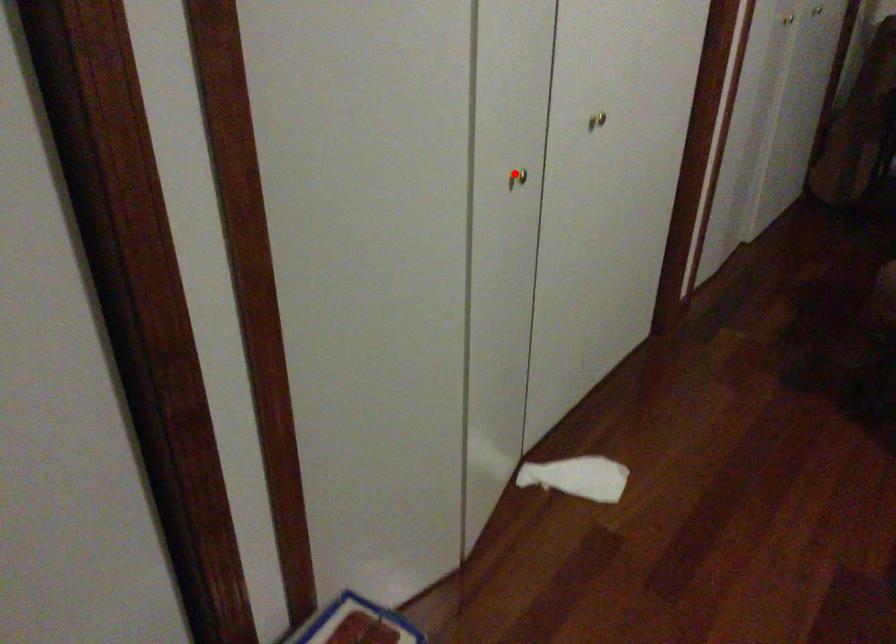
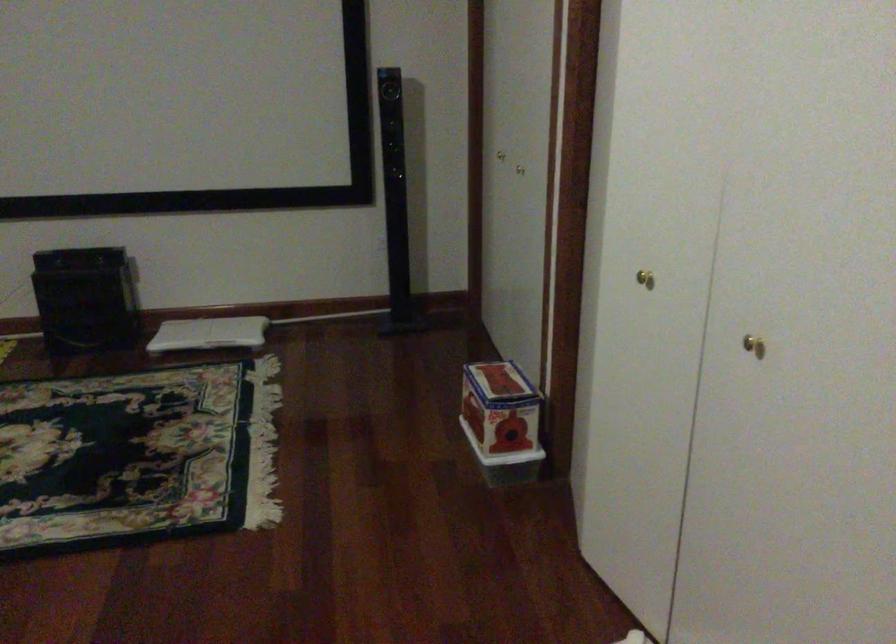
Where in the second image is the point corresponding to the highlighted location from the first image?

(644, 279)